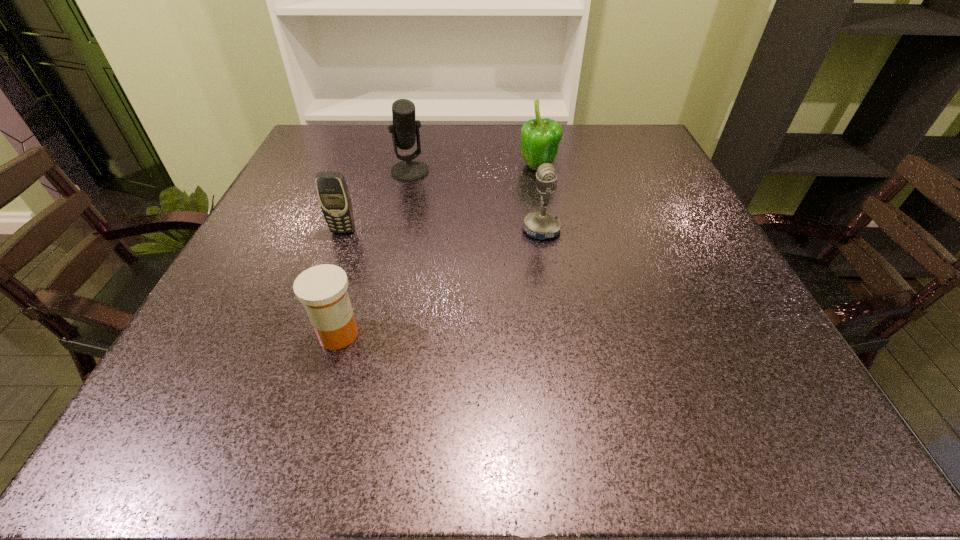
Identify the location of vacant area situated 0.180m on the front-facing side of the shorter microphone. coord(435,230).

Find the location of a particular element. This screenshot has width=960, height=540. free space located 0.160m on the front-facing side of the shorter microphone is located at coordinates (444, 230).

At what (x,y) coordinates should I click in order to perform the action: click on free space located on the front face of the cellular telephone. Please return your answer as a coordinate pair (x, y). Image resolution: width=960 pixels, height=540 pixels. Looking at the image, I should click on (292, 373).

This screenshot has width=960, height=540. What are the coordinates of `vacant space located on the label of the nearest object` in the screenshot? It's located at (393, 334).

You are a GUI agent. You are given a task and a screenshot of the screen. Output one action in this format:
    pyautogui.click(x=<x>, y=<y>)
    Task: Click on the microphone located in the far edge section of the desktop
    This screenshot has height=540, width=960.
    Given the screenshot: What is the action you would take?
    pyautogui.click(x=405, y=131)

At what (x,y) coordinates should I click in order to perform the action: click on bell pepper located at the far edge. Please return your answer as a coordinate pair (x, y). The width and height of the screenshot is (960, 540). Looking at the image, I should click on (540, 138).

This screenshot has width=960, height=540. I want to click on object at the left edge, so click(333, 194).

At what (x,y) coordinates should I click in order to perform the action: click on vacant space at the far edge. Please return your answer as a coordinate pair (x, y). Looking at the image, I should click on (500, 167).

What are the coordinates of `free space at the near edge of the desktop` in the screenshot? It's located at (276, 451).

The height and width of the screenshot is (540, 960). What are the coordinates of `blank space at the left edge of the desktop` in the screenshot? It's located at (300, 230).